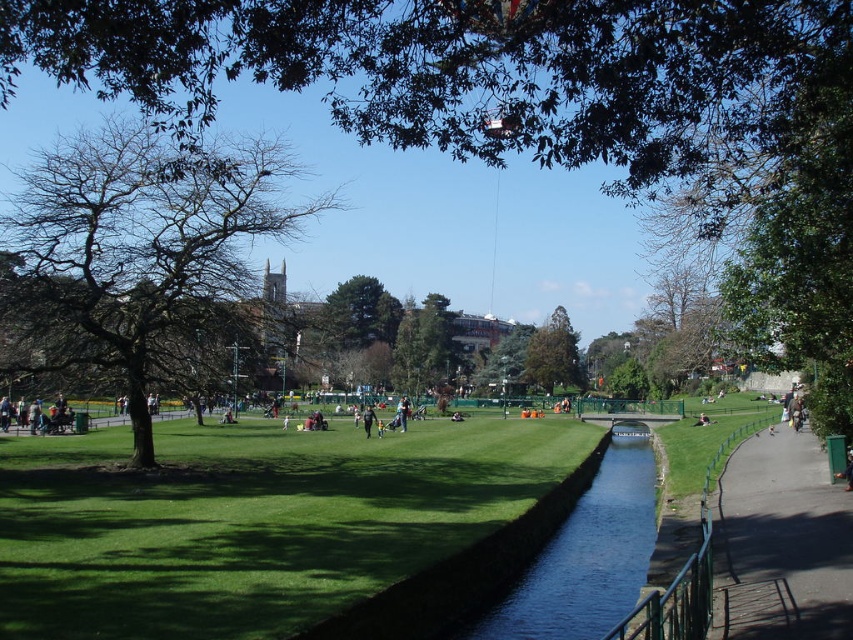
You are planning to set up a picnic blanket in the park. You have a large blanket that requires a space wider than the clear water at center. Can you place it on the green grass at center?

The green grass at center is wider than the clear water at center, so yes, you can place the picnic blanket there as it has sufficient width.

You are standing in the park and want to reach a specific point marked as point (84,557). If you are currently 10 meters away from it, how much further do you need to walk to reach the point?

The distance of point (84,557) from viewer is 13.48 meters. Since you are currently 10 meters away, you need to walk an additional 3.48 meters to reach the point.

You are planning to take a photo of the green leafy tree at center and the light brown leather jacket at lower right. Which object will appear bigger in the photo?

The green leafy tree at center will appear bigger in the photo because it has a larger size compared to the light brown leather jacket at lower right.